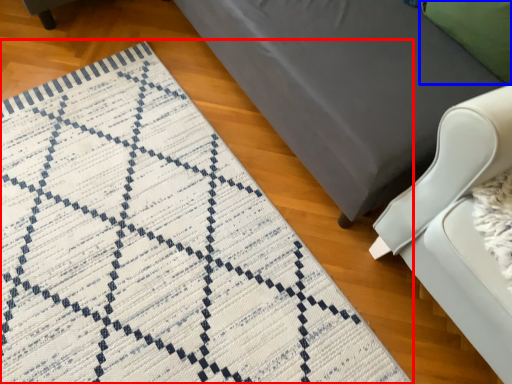
Question: Which object is further to the camera taking this photo, mat (highlighted by a red box) or pillow (highlighted by a blue box)?

Choices:
 (A) mat
 (B) pillow

Answer: (B)